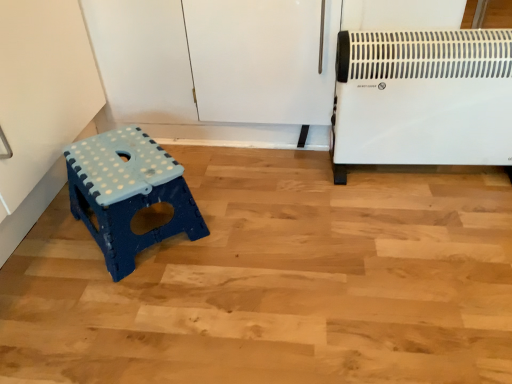
Locate an element on the screen. free space in front of white plastic heater at right is located at coordinates (434, 240).